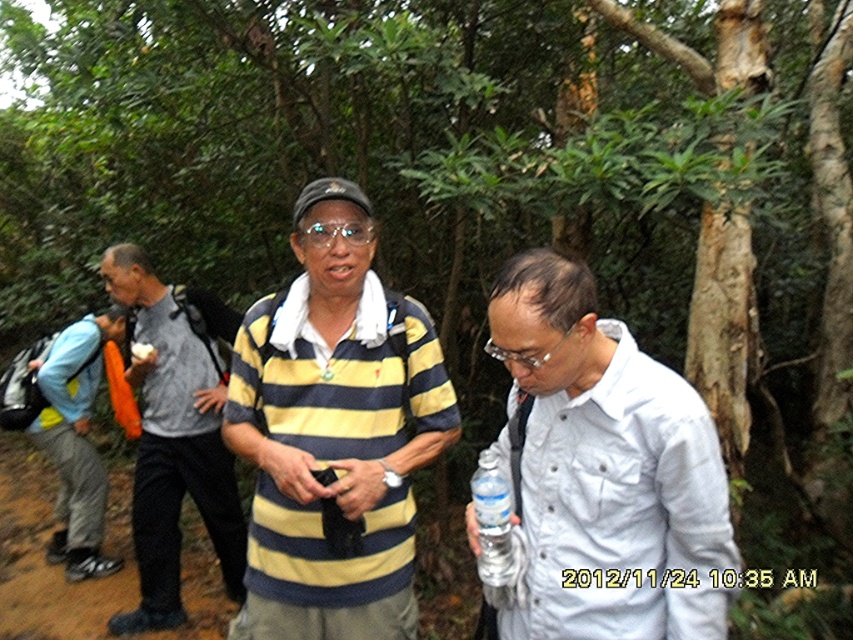
You are standing at the entrance of the forest path. You see the yellow striped shirt at center. Based on its position, can you determine if it is closer to the left or right side of the path?

The yellow striped shirt at center is located at point 0.680 on the x axis, which is closer to the right side of the path since the center is at 0.5. Therefore, the yellow striped shirt at center is positioned more to the right side of the path.

You are a photographer trying to capture a candid shot of both the yellow striped shirt at center and the white matte shirt at center. Since you want to ensure both are in focus, which one should you adjust your camera to prioritize focusing on first?

The yellow striped shirt at center is further to the viewer than the white matte shirt at center, so you should focus on the yellow striped shirt at center first to ensure both are in focus.

You are navigating through a forest path and see two points marked in the scene. The first point is at coordinates point [517,408] and the second is at point [177,566]. Which point is closer to you as you stand on the path?

Point [517,408] is in front of point [177,566], so it is closer to you as you stand on the path.